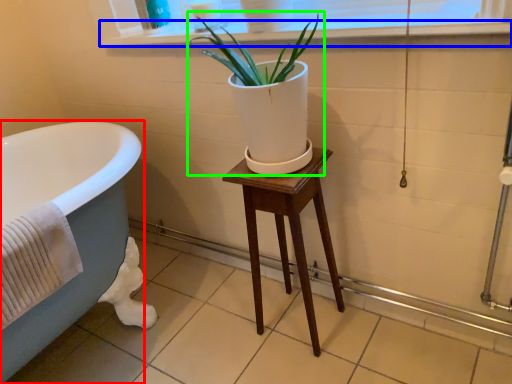
Question: Which object is the closest to the bathtub (highlighted by a red box)? Choose among these: window sill (highlighted by a blue box) or houseplant (highlighted by a green box).

Choices:
 (A) window sill
 (B) houseplant

Answer: (B)